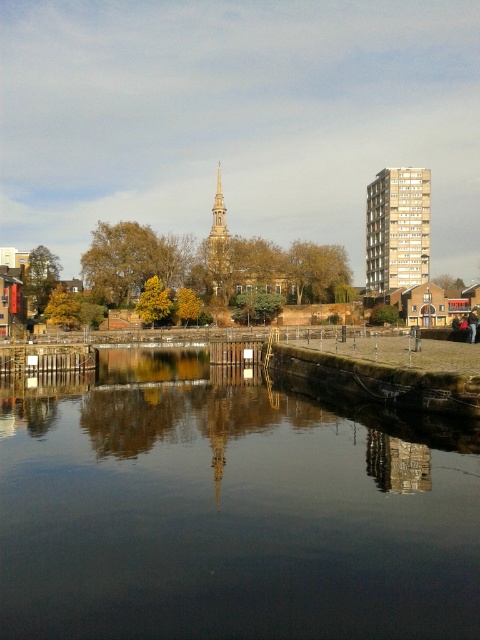
You are an architect designing a new sculpture that needs to be placed in the water. The sculpture will be 1.2 meters tall. Considering the dark reflective water at center and the gold textured spire at center, which object will be taller than the sculpture?

The gold textured spire at center is taller than the dark reflective water at center, so the gold textured spire at center will be taller than the 1.2 meter sculpture.

You are a photographer planning to capture the reflection of the gold textured spire at center in the dark reflective water at center. Based on the scene description, will the spire be visible in the water?

The dark reflective water at center is to the right of gold textured spire at center, so the spire will be reflected in the water since the water is positioned to the right of the spire.

You are a tourist standing at the edge of the dark reflective water at center, looking towards the gold metallic building at upper right. Can you see the building reflected in the water?

Yes, the dark reflective water at center is in front of the gold metallic building at upper right, so the building would be reflected in the water since the water is reflective and positioned in front of it.